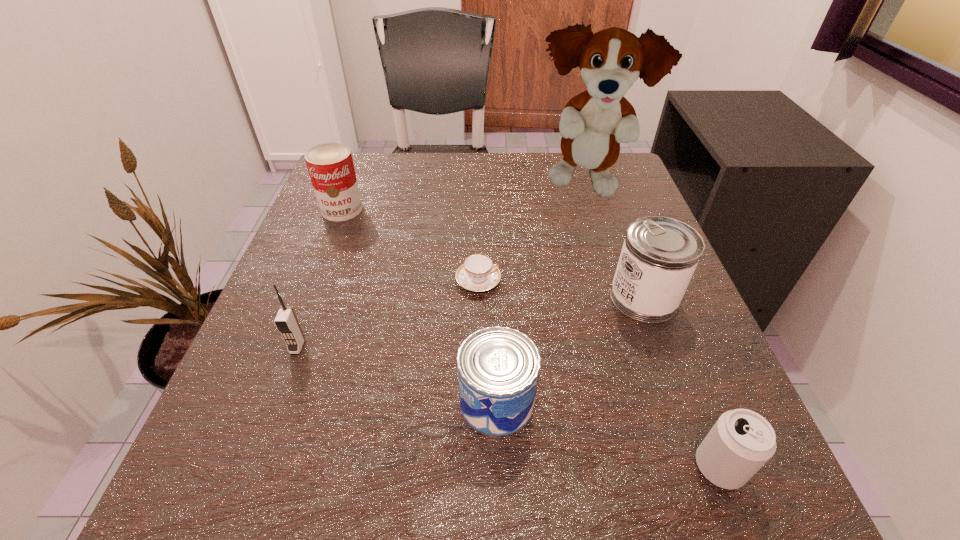
This screenshot has height=540, width=960. In the image, there is a desktop. Find the location of `free space at the far left corner`. free space at the far left corner is located at coordinates (380, 154).

Where is `free spot at the far right corner of the desktop`? free spot at the far right corner of the desktop is located at coordinates (562, 159).

Find the location of a particular element. The height and width of the screenshot is (540, 960). free spot between the nearest object and the third farthest can is located at coordinates (608, 434).

This screenshot has width=960, height=540. What are the coordinates of `vacant area between the cellular telephone and the third nearest can` in the screenshot? It's located at (470, 322).

Where is `free area in between the third nearest object and the second farthest can`? free area in between the third nearest object and the second farthest can is located at coordinates (470, 322).

Find the location of a particular element. The height and width of the screenshot is (540, 960). free space that is in between the third nearest object and the shortest object is located at coordinates (388, 314).

Locate an element on the screen. The image size is (960, 540). vacant space in between the teacup and the leftmost can is located at coordinates (410, 245).

Where is `free spot between the cellular telephone and the sixth farthest object`? This screenshot has height=540, width=960. free spot between the cellular telephone and the sixth farthest object is located at coordinates (397, 374).

Identify the location of free space between the shortest object and the third nearest can. The width and height of the screenshot is (960, 540). click(x=561, y=289).

In order to click on vacant point located between the third farthest can and the nearest can in this screenshot , I will do `click(608, 434)`.